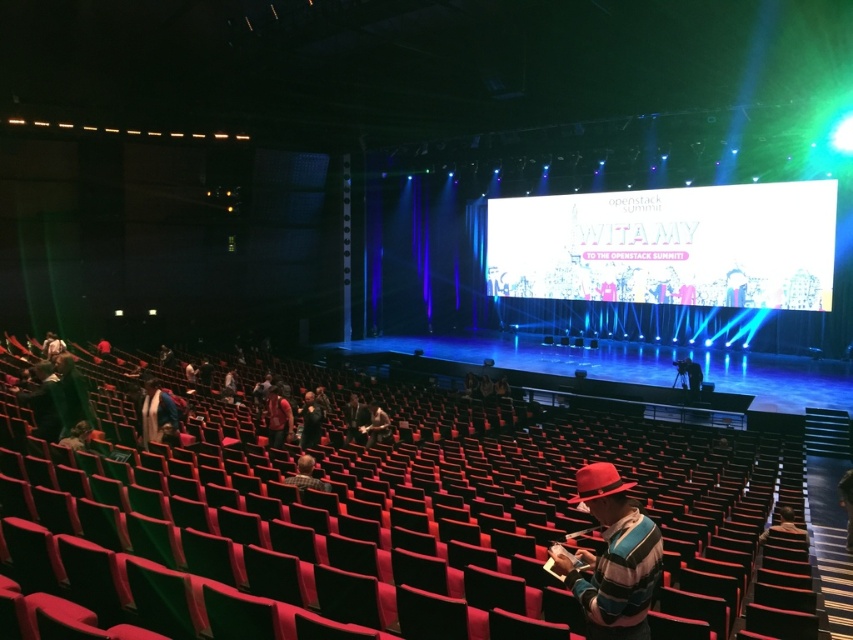
You are an event organizer at the OpenStack Summit. You notice two red items in the image. The red felt hat at lower right and the matte red shirt at center. Which of these items is narrower in width?

The red felt hat at lower right is thinner than the matte red shirt at center, so the red felt hat at lower right is narrower in width.

You are organizing a photo shoot in this auditorium and need to place a mannequin wearing a wide hat. The mannequin requires a space wider than the red felt hat at center. Is the plaid shirt at lower center a suitable location for placing the mannequin?

The red felt hat at center is narrower than the plaid shirt at lower center. Therefore, the plaid shirt at lower center provides sufficient width for the mannequin wearing the wide hat.